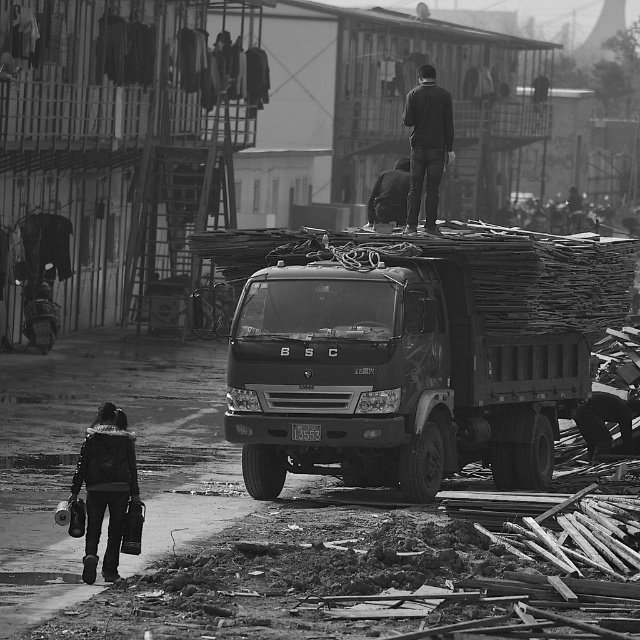
How much distance is there between dark gray metallic truck at center and dark gray fabric jacket at upper center?

dark gray metallic truck at center and dark gray fabric jacket at upper center are 10.24 feet apart from each other.

Between dark gray metallic truck at center and dark gray fabric jacket at upper center, which one has less height?

Standing shorter between the two is dark gray metallic truck at center.

Locate an element on the screen. This screenshot has width=640, height=640. dark gray metallic truck at center is located at coordinates (390, 378).

What are the coordinates of `dark gray metallic truck at center` in the screenshot? It's located at (390, 378).

How distant is black fuzzy jacket at lower left from dark fabric jacket at upper center?

The distance of black fuzzy jacket at lower left from dark fabric jacket at upper center is 7.04 meters.

Can you confirm if black fuzzy jacket at lower left is positioned to the left of dark fabric jacket at upper center?

Indeed, black fuzzy jacket at lower left is positioned on the left side of dark fabric jacket at upper center.

Where is `black fuzzy jacket at lower left`? This screenshot has height=640, width=640. black fuzzy jacket at lower left is located at coordinates (106, 486).

Is point (509, 412) more distant than point (436, 164)?

Yes.

Between dark gray metallic truck at center and dark fabric jacket at upper center, which one is positioned lower?

dark gray metallic truck at center

Is point (509, 432) positioned after point (413, 140)?

That is False.

Locate an element on the screen. The image size is (640, 640). dark gray metallic truck at center is located at coordinates (390, 378).